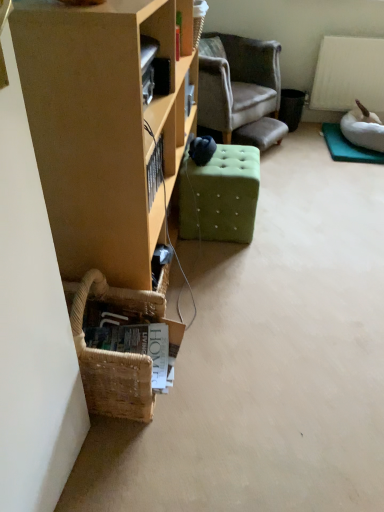
The width and height of the screenshot is (384, 512). I want to click on free spot in front of woven brown basket at lower left, so click(135, 453).